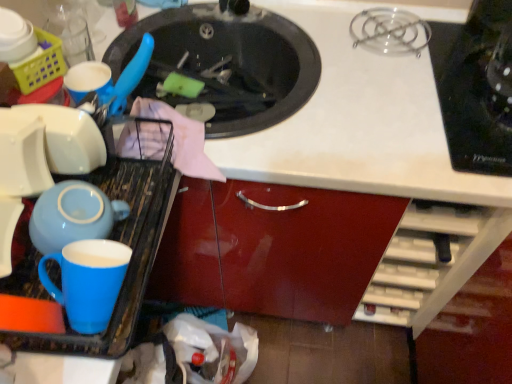
Question: Is black glossy sink at upper center inside or outside of plastic yellow basket at upper left?

Choices:
 (A) inside
 (B) outside

Answer: (B)

Question: Considering the positions of black glossy sink at upper center and plastic yellow basket at upper left in the image, is black glossy sink at upper center wider or thinner than plastic yellow basket at upper left?

Choices:
 (A) thin
 (B) wide

Answer: (B)

Question: Based on their relative distances, which object is nearer to the black glass cooktop at upper right?

Choices:
 (A) matte blue mug at lower left
 (B) black glossy sink at upper center
 (C) plastic yellow basket at upper left
 (D) blue glossy mug at left

Answer: (B)

Question: Based on their relative distances, which object is nearer to the black glass cooktop at upper right?

Choices:
 (A) black glossy sink at upper center
 (B) plastic yellow basket at upper left
 (C) matte blue mug at lower left
 (D) blue glossy mug at left

Answer: (A)